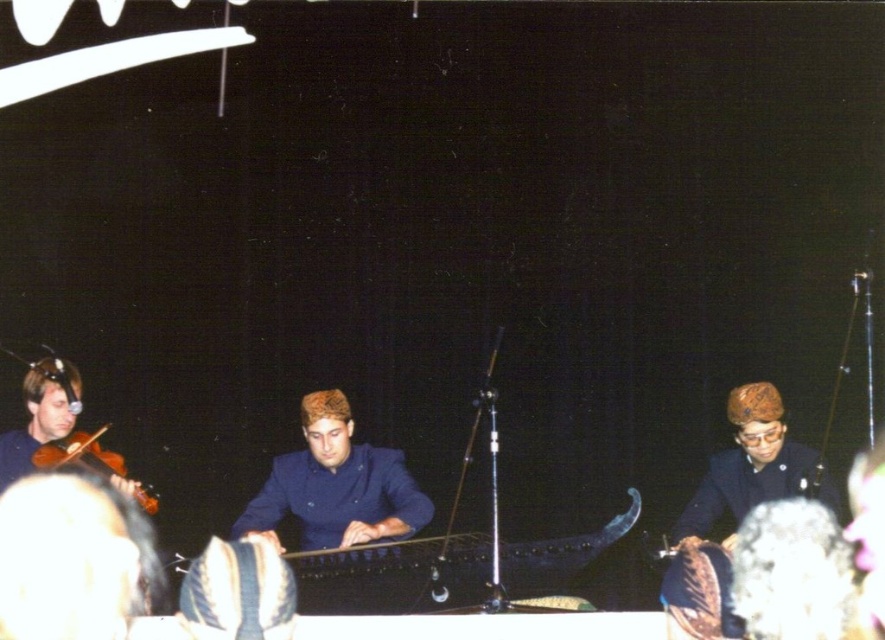
Can you confirm if dark blue fabric at center is taller than dark blue uniform at center?

Yes.

Who is positioned more to the right, dark blue fabric at center or dark blue uniform at center?

dark blue uniform at center is more to the right.

Is point (322, 422) closer to camera compared to point (791, 452)?

No, (322, 422) is further to viewer.

This screenshot has height=640, width=885. I want to click on dark blue fabric at center, so click(x=335, y=484).

Is the position of dark blue fabric at center more distant than that of matte brown violin at left?

That is False.

How distant is dark blue fabric at center from matte brown violin at left?

They are 25.32 inches apart.

At what (x,y) coordinates should I click in order to perform the action: click on dark blue fabric at center. Please return your answer as a coordinate pair (x, y). The image size is (885, 640). Looking at the image, I should click on point(335,484).

Is dark blue uniform at center to the right of matte brown violin at left from the viewer's perspective?

Correct, you'll find dark blue uniform at center to the right of matte brown violin at left.

Which is more to the left, dark blue uniform at center or matte brown violin at left?

matte brown violin at left

This screenshot has height=640, width=885. Describe the element at coordinates (752, 465) in the screenshot. I see `dark blue uniform at center` at that location.

In order to click on dark blue uniform at center in this screenshot , I will do `click(752, 465)`.